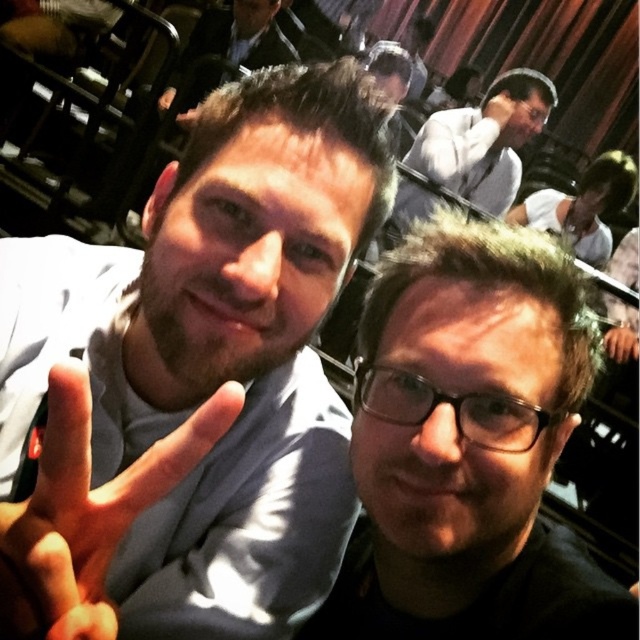
Question: Which is farther from the matte black hand at lower right?

Choices:
 (A) black matte glasses at center
 (B) dark gray suit at upper center

Answer: (A)

Question: Which is nearer to the gray fabric shirt at center?

Choices:
 (A) dark gray suit at upper center
 (B) black matte glasses at center

Answer: (B)

Question: Does black matte glasses at center appear over dark gray suit at upper center?

Choices:
 (A) no
 (B) yes

Answer: (A)

Question: Is black matte glasses at center to the left of white cotton shirt at upper right from the viewer's perspective?

Choices:
 (A) yes
 (B) no

Answer: (A)

Question: In this image, where is black matte glasses at center located relative to skinny-fingered hand at center?

Choices:
 (A) below
 (B) above

Answer: (A)

Question: Which object is the closest to the dark gray suit at upper center?

Choices:
 (A) skinny-fingered hand at center
 (B) black matte glasses at center
 (C) matte black hand at lower right

Answer: (C)